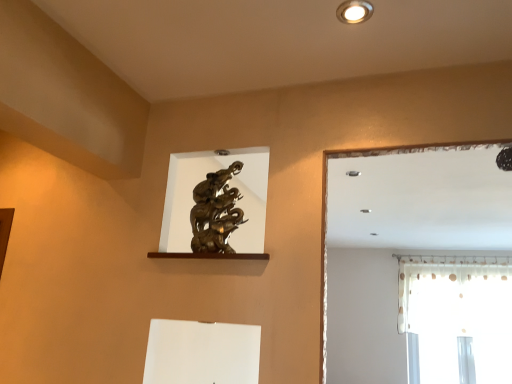
What do you see at coordinates (456, 318) in the screenshot? I see `white sheer curtain at right` at bounding box center [456, 318].

Locate an element on the screen. Image resolution: width=512 pixels, height=384 pixels. white sheer curtain at right is located at coordinates (456, 318).

In order to face white sheer curtain at right, should I rotate leftwards or rightwards?

It's best to rotate right around 25.113 degrees.

What is the approximate width of white sheer curtain at right?

12.60 inches.

Find the location of `matte white recessed light at upper center`. matte white recessed light at upper center is located at coordinates 354,11.

What do you see at coordinates (354, 11) in the screenshot? The width and height of the screenshot is (512, 384). I see `matte white recessed light at upper center` at bounding box center [354, 11].

This screenshot has width=512, height=384. I want to click on white sheer curtain at right, so click(x=456, y=318).

Considering the positions of objects white sheer curtain at right and matte white recessed light at upper center in the image provided, who is more to the right, white sheer curtain at right or matte white recessed light at upper center?

From the viewer's perspective, white sheer curtain at right appears more on the right side.

Consider the image. Is white sheer curtain at right closer to the viewer compared to matte white recessed light at upper center?

No.

Is point (423, 318) positioned behind point (360, 13)?

Yes.

From the image's perspective, is white sheer curtain at right positioned above or below matte white recessed light at upper center?

Clearly, from the image's perspective, white sheer curtain at right is below matte white recessed light at upper center.

From a real-world perspective, which object stands above the other?

matte white recessed light at upper center, from a real-world perspective.

In terms of width, does white sheer curtain at right look wider or thinner when compared to matte white recessed light at upper center?

Considering their sizes, white sheer curtain at right looks broader than matte white recessed light at upper center.

Is white sheer curtain at right taller or shorter than matte white recessed light at upper center?

Considering their sizes, white sheer curtain at right has more height than matte white recessed light at upper center.

Which of these two, white sheer curtain at right or matte white recessed light at upper center, is bigger?

With larger size is white sheer curtain at right.

Would you say white sheer curtain at right contains matte white recessed light at upper center?

No, matte white recessed light at upper center is located outside of white sheer curtain at right.

Is white sheer curtain at right touching matte white recessed light at upper center?

No, white sheer curtain at right is not next to matte white recessed light at upper center.

Is white sheer curtain at right turned away from matte white recessed light at upper center?

No.

Measure the distance between white sheer curtain at right and matte white recessed light at upper center.

They are 4.68 meters apart.

Locate an element on the screen. window that appears below the matte white recessed light at upper center (from the image's perspective) is located at coordinates (456, 318).

Can you confirm if matte white recessed light at upper center is positioned to the right of white sheer curtain at right?

No.

From the picture: Is matte white recessed light at upper center further to camera compared to white sheer curtain at right?

That is False.

Which is closer, (354, 22) or (502, 298)?

Point (354, 22).

From the image's perspective, is matte white recessed light at upper center located above white sheer curtain at right?

Correct, matte white recessed light at upper center appears higher than white sheer curtain at right in the image.

From a real-world perspective, is matte white recessed light at upper center physically above white sheer curtain at right?

Indeed, from a real-world perspective, matte white recessed light at upper center stands above white sheer curtain at right.

Is matte white recessed light at upper center wider or thinner than white sheer curtain at right?

Considering their sizes, matte white recessed light at upper center looks slimmer than white sheer curtain at right.

Is matte white recessed light at upper center taller than white sheer curtain at right?

Incorrect, the height of matte white recessed light at upper center is not larger of that of white sheer curtain at right.

Can you confirm if matte white recessed light at upper center is smaller than white sheer curtain at right?

Indeed, matte white recessed light at upper center has a smaller size compared to white sheer curtain at right.

Would you say matte white recessed light at upper center contains white sheer curtain at right?

No.

Is matte white recessed light at upper center touching white sheer curtain at right?

They are not placed beside each other.

Based on the photo, is matte white recessed light at upper center aimed at white sheer curtain at right?

No, matte white recessed light at upper center is not turned towards white sheer curtain at right.

How many degrees apart are the facing directions of matte white recessed light at upper center and white sheer curtain at right?

matte white recessed light at upper center and white sheer curtain at right are facing 2.35 degrees away from each other.

The width and height of the screenshot is (512, 384). What are the coordinates of `lighting on the left of the white sheer curtain at right` in the screenshot? It's located at (354, 11).

Where is `window on the right side of matte white recessed light at upper center`? The image size is (512, 384). window on the right side of matte white recessed light at upper center is located at coordinates (456, 318).

Find the location of a particular element. lighting positioned vertically above the white sheer curtain at right (from a real-world perspective) is located at coordinates (354, 11).